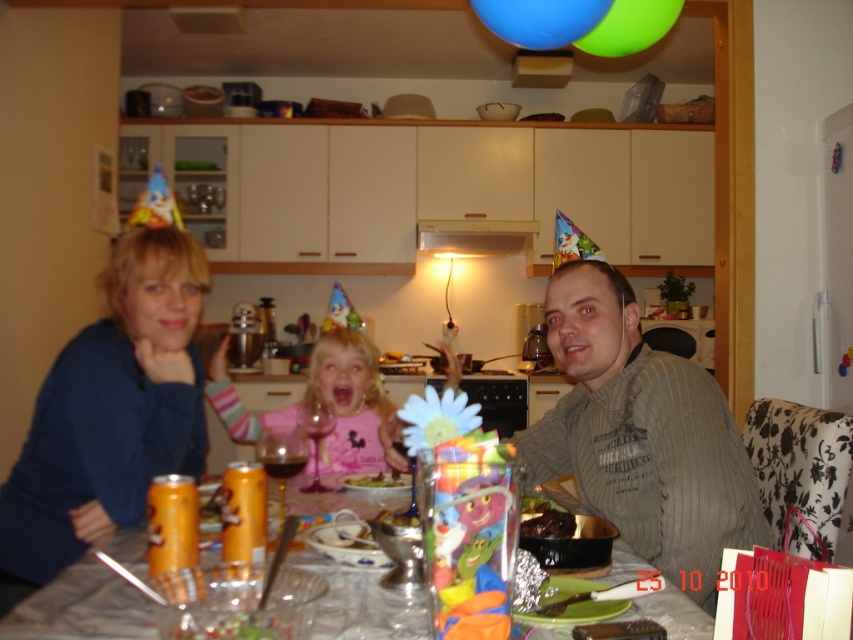
Question: Is blue fleece sweater at left below pink cotton shirt at center?

Choices:
 (A) yes
 (B) no

Answer: (B)

Question: Which is nearer to the translucent plastic bowl at center?

Choices:
 (A) pink cotton shirt at center
 (B) gray striped shirt at center
 (C) blue fleece sweater at left

Answer: (C)

Question: Which point is closer to the camera taking this photo?

Choices:
 (A) (154, 369)
 (B) (766, 532)
 (C) (126, 532)
 (D) (396, 465)

Answer: (C)

Question: Does gray striped shirt at center appear on the right side of translucent plastic bowl at center?

Choices:
 (A) yes
 (B) no

Answer: (A)

Question: Is translucent plastic bowl at center in front of pink cotton shirt at center?

Choices:
 (A) yes
 (B) no

Answer: (A)

Question: Which point is closer to the camera?

Choices:
 (A) pink cotton shirt at center
 (B) blue fleece sweater at left
 (C) translucent plastic bowl at center
 (D) gray striped shirt at center

Answer: (C)